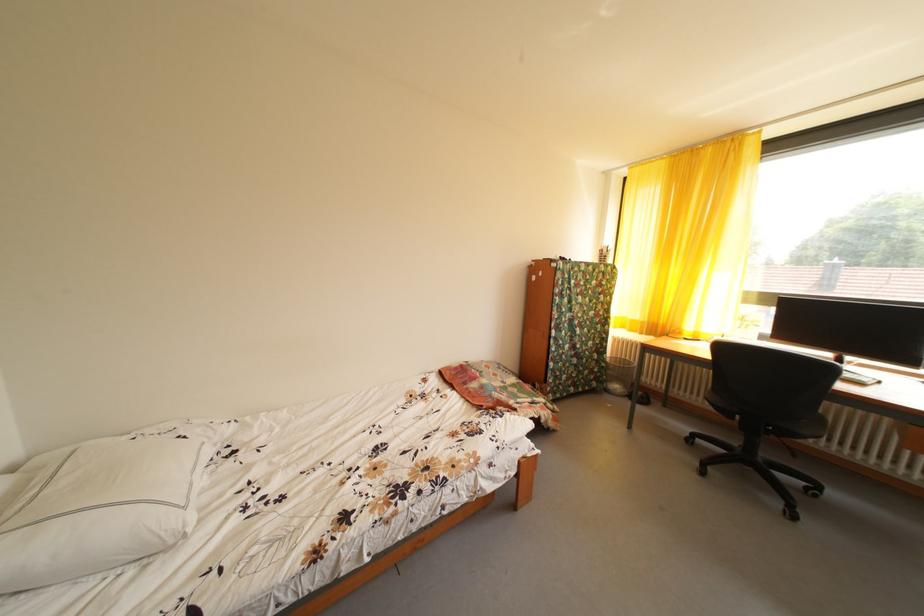
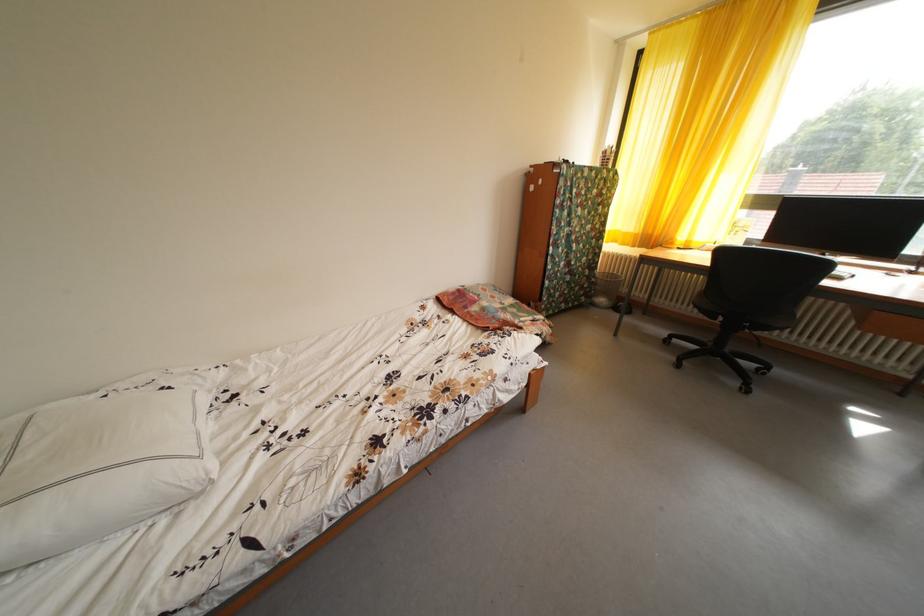
Locate, in the second image, the point that corresponds to (604,376) in the first image.

(594, 292)